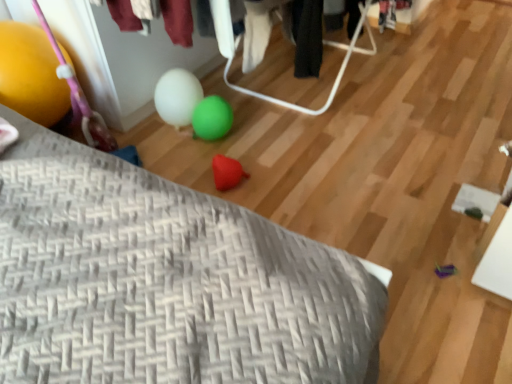
Question: Would you say gray woven pillow at lower left is to the left or to the right of yellow rubber balloon at left in the picture?

Choices:
 (A) right
 (B) left

Answer: (A)

Question: Is gray woven pillow at lower left in front of or behind yellow rubber balloon at left in the image?

Choices:
 (A) front
 (B) behind

Answer: (A)

Question: Which object is positioned farthest from the rubber heart at center?

Choices:
 (A) yellow rubber balloon at left
 (B) gray woven pillow at lower left

Answer: (B)

Question: Which of these objects is positioned farthest from the yellow rubber balloon at left?

Choices:
 (A) gray woven pillow at lower left
 (B) rubber heart at center

Answer: (B)